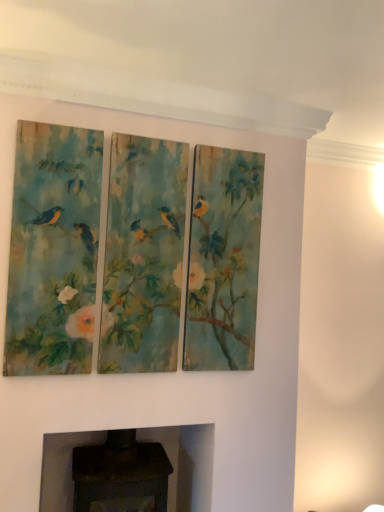
Question: From the image's perspective, relative to dark gray stone fireplace at lower center, is textured canvas triptych at center above or below?

Choices:
 (A) below
 (B) above

Answer: (B)

Question: From a real-world perspective, is textured canvas triptych at center positioned above or below dark gray stone fireplace at lower center?

Choices:
 (A) below
 (B) above

Answer: (B)

Question: Looking at their shapes, would you say textured canvas triptych at center is wider or thinner than dark gray stone fireplace at lower center?

Choices:
 (A) wide
 (B) thin

Answer: (B)

Question: Do you think dark gray stone fireplace at lower center is within textured canvas triptych at center, or outside of it?

Choices:
 (A) outside
 (B) inside

Answer: (A)

Question: From the image's perspective, is dark gray stone fireplace at lower center positioned above or below textured canvas triptych at center?

Choices:
 (A) above
 (B) below

Answer: (B)

Question: Looking at their shapes, would you say dark gray stone fireplace at lower center is wider or thinner than textured canvas triptych at center?

Choices:
 (A) wide
 (B) thin

Answer: (A)

Question: From a real-world perspective, is dark gray stone fireplace at lower center positioned above or below textured canvas triptych at center?

Choices:
 (A) below
 (B) above

Answer: (A)